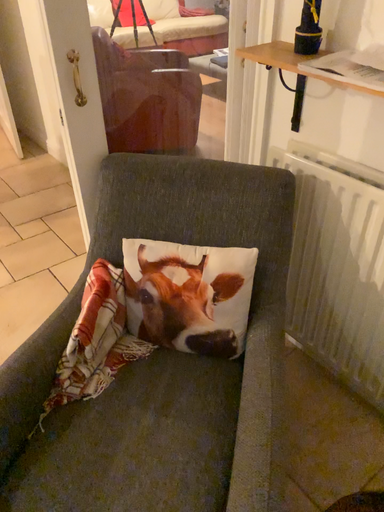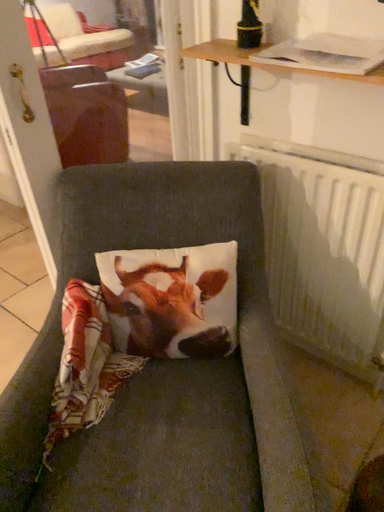
Question: Which way did the camera rotate in the video?

Choices:
 (A) rotated left
 (B) rotated right

Answer: (B)